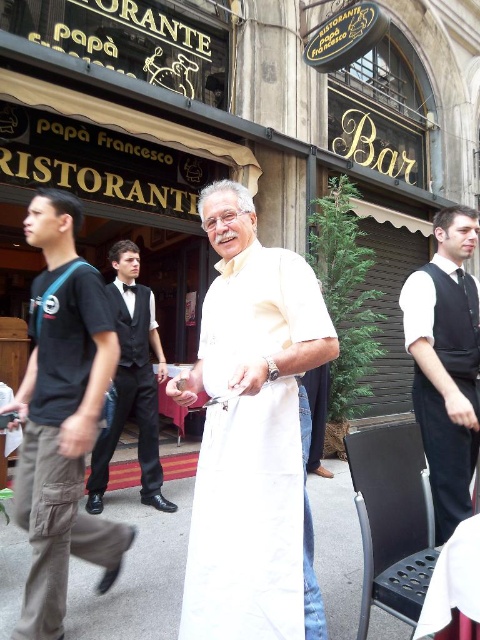
You are a customer at Papa Francesco Ristorante Bar and you notice two points in the image. The first point is at coordinates point (229, 269) and the second is at point (157, 465). Which point is closer to you as a customer sitting at the table?

Point (229, 269) is closer to the camera than point (157, 465), so the first point is closer to you as a customer sitting at the table.